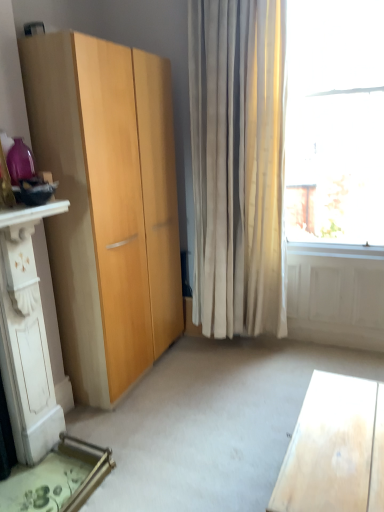
Where is `empty space that is ontop of light wood desk at lower right (from a real-world perspective)`? This screenshot has width=384, height=512. empty space that is ontop of light wood desk at lower right (from a real-world perspective) is located at coordinates (342, 444).